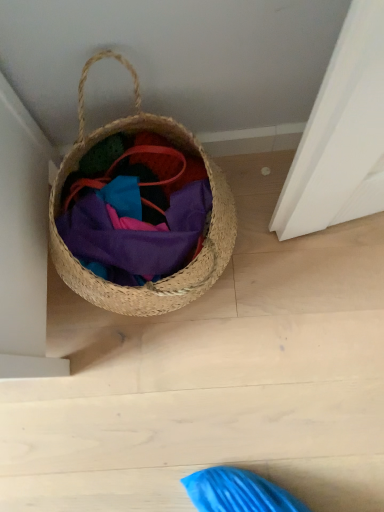
The width and height of the screenshot is (384, 512). What do you see at coordinates (136, 226) in the screenshot?
I see `matte woven basket at center` at bounding box center [136, 226].

I want to click on matte woven basket at center, so click(136, 226).

In order to face matte woven basket at center, should I rotate leftwards or rightwards?

Turn left by 7.109 degrees to look at matte woven basket at center.

Locate an element on the screen. woven straw basket at left is located at coordinates 175,273.

The width and height of the screenshot is (384, 512). What do you see at coordinates (175, 273) in the screenshot? I see `woven straw basket at left` at bounding box center [175, 273].

Where is `matte woven basket at center`? matte woven basket at center is located at coordinates (136, 226).

Considering the relative positions of woven straw basket at left and matte woven basket at center in the image provided, is woven straw basket at left to the left of matte woven basket at center from the viewer's perspective?

Correct, you'll find woven straw basket at left to the left of matte woven basket at center.

Between woven straw basket at left and matte woven basket at center, which one is positioned behind?

matte woven basket at center is more distant.

Is point (87, 280) more distant than point (176, 247)?

No, (87, 280) is closer to viewer.

From the picture: From the image's perspective, is woven straw basket at left beneath matte woven basket at center?

No.

From a real-world perspective, is woven straw basket at left above or below matte woven basket at center?

Clearly, from a real-world perspective, woven straw basket at left is above matte woven basket at center.

Does woven straw basket at left have a greater width compared to matte woven basket at center?

Yes, woven straw basket at left is wider than matte woven basket at center.

Considering the relative sizes of woven straw basket at left and matte woven basket at center in the image provided, is woven straw basket at left taller than matte woven basket at center?

Yes.

Does woven straw basket at left have a larger size compared to matte woven basket at center?

Yes, woven straw basket at left is bigger than matte woven basket at center.

Do you think woven straw basket at left is within matte woven basket at center, or outside of it?

woven straw basket at left is not enclosed by matte woven basket at center.

Is woven straw basket at left not close to matte woven basket at center?

No, woven straw basket at left is not far from matte woven basket at center.

Is woven straw basket at left oriented away from matte woven basket at center?

Yes, woven straw basket at left is positioned with its back facing matte woven basket at center.

Identify the location of bag behind the woven straw basket at left. The image size is (384, 512). (136, 226).

Between matte woven basket at center and woven straw basket at left, which one appears on the left side from the viewer's perspective?

From the viewer's perspective, woven straw basket at left appears more on the left side.

Considering the relative positions of matte woven basket at center and woven straw basket at left in the image provided, is matte woven basket at center behind woven straw basket at left?

Yes, matte woven basket at center is further from the camera.

Does point (105, 244) appear closer or farther from the camera than point (235, 218)?

Clearly, point (105, 244) is closer to the camera than point (235, 218).

From the image's perspective, is matte woven basket at center located above or below woven straw basket at left?

matte woven basket at center is below woven straw basket at left.

From a real-world perspective, which object rests below the other?

matte woven basket at center, from a real-world perspective.

Considering the sizes of objects matte woven basket at center and woven straw basket at left in the image provided, who is thinner, matte woven basket at center or woven straw basket at left?

matte woven basket at center.

Does matte woven basket at center have a lesser height compared to woven straw basket at left?

Indeed, matte woven basket at center has a lesser height compared to woven straw basket at left.

Can you confirm if matte woven basket at center is smaller than woven straw basket at left?

Indeed, matte woven basket at center has a smaller size compared to woven straw basket at left.

Which is correct: matte woven basket at center is inside woven straw basket at left, or outside of it?

matte woven basket at center is enclosed within woven straw basket at left.

Are matte woven basket at center and woven straw basket at left beside each other?

Indeed, matte woven basket at center and woven straw basket at left are beside each other and touching.

Is matte woven basket at center positioned with its back to woven straw basket at left?

Yes.

Locate an element on the screen. Image resolution: width=384 pixels, height=512 pixels. picnic basket that is in front of the matte woven basket at center is located at coordinates (175, 273).

The height and width of the screenshot is (512, 384). I want to click on bag that appears on the right of woven straw basket at left, so click(x=136, y=226).

Identify the location of picnic basket that appears above the matte woven basket at center (from the image's perspective). This screenshot has height=512, width=384. (175, 273).